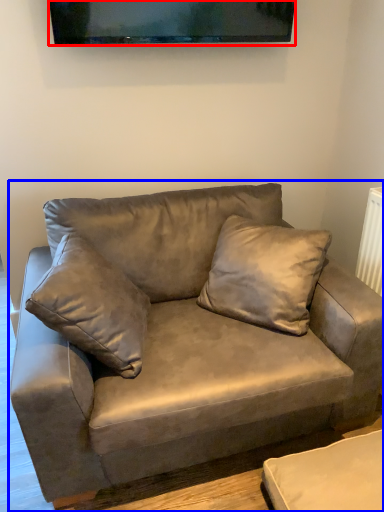
Question: Which object appears farthest to the camera in this image, television (highlighted by a red box) or studio couch (highlighted by a blue box)?

Choices:
 (A) television
 (B) studio couch

Answer: (A)